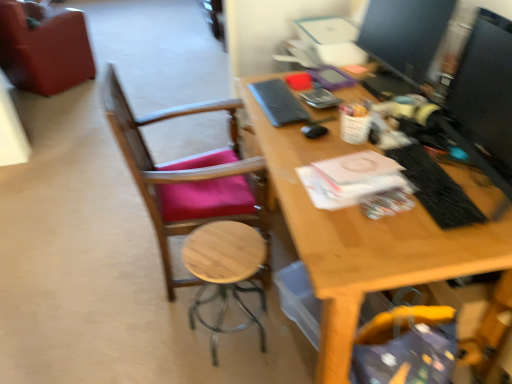
Where is `free space behind wooden stool at center`? Image resolution: width=512 pixels, height=384 pixels. free space behind wooden stool at center is located at coordinates (231, 284).